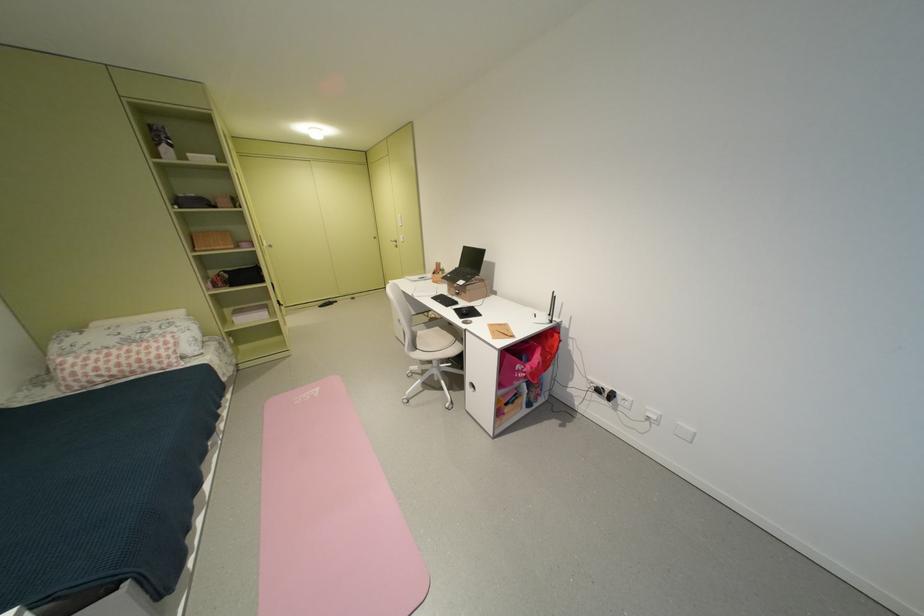
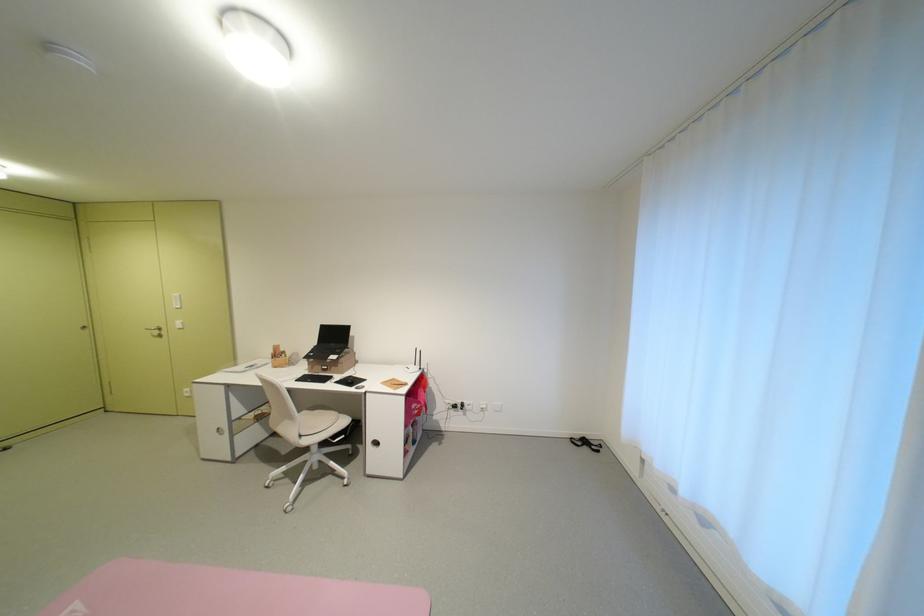
Locate, in the second image, the point that corresponds to [428,349] in the first image.

(311, 436)